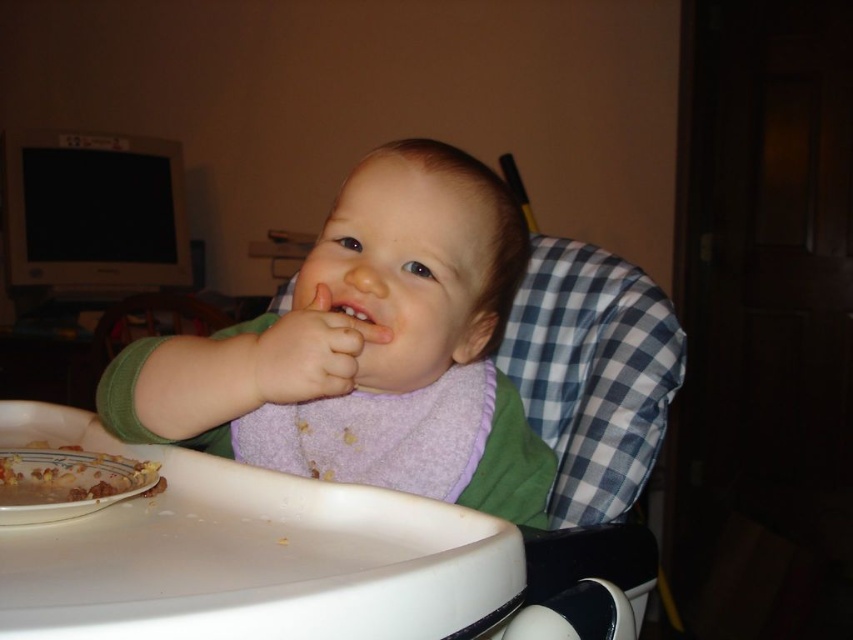
Can you confirm if purple fabric bib at center is smaller than smooth skin mouth at center?

Actually, purple fabric bib at center might be larger than smooth skin mouth at center.

This screenshot has width=853, height=640. I want to click on purple fabric bib at center, so click(x=368, y=349).

Is point (323, 296) farther from camera compared to point (4, 465)?

Yes, it is.

Does pink soft skin at center have a greater height compared to yellowish textured food at lower left?

Yes, pink soft skin at center is taller than yellowish textured food at lower left.

Identify the location of pink soft skin at center. The height and width of the screenshot is (640, 853). (306, 353).

Who is positioned more to the left, purple fabric bib at center or pink soft skin at center?

pink soft skin at center is more to the left.

Can you confirm if purple fabric bib at center is positioned below pink soft skin at center?

Yes.

Does point (322, 285) lie behind point (248, 381)?

Yes, point (322, 285) is behind point (248, 381).

Where is `purple fabric bib at center`? This screenshot has width=853, height=640. purple fabric bib at center is located at coordinates (368, 349).